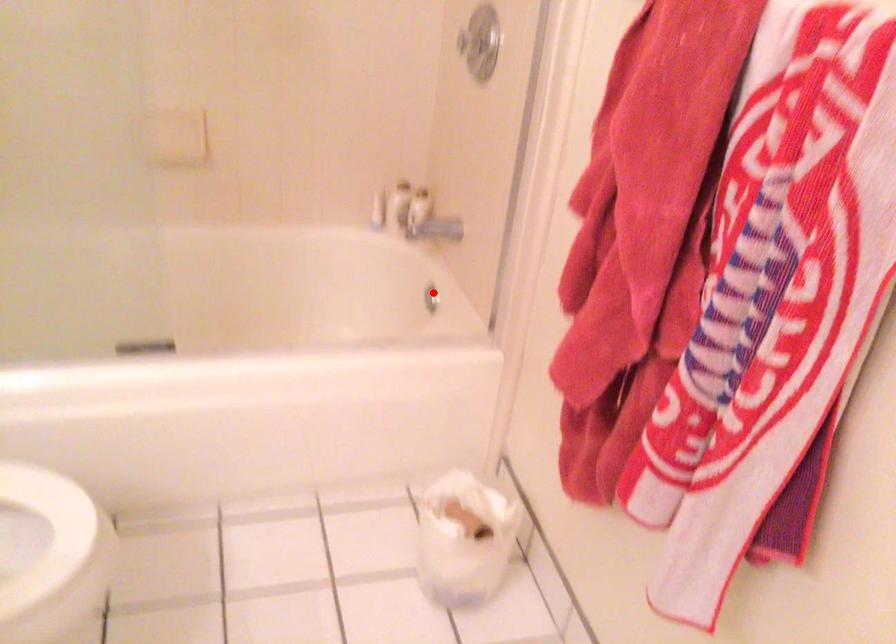
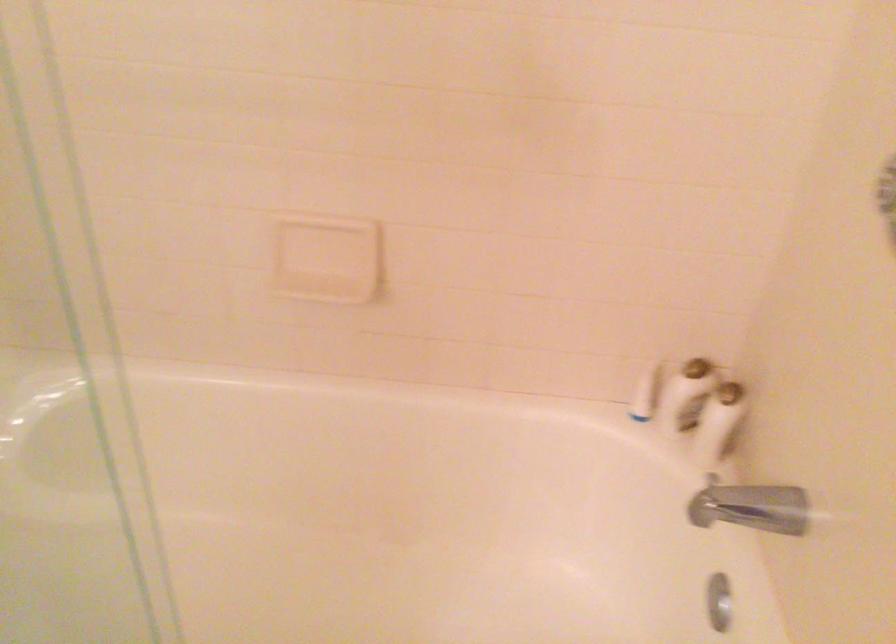
In the second image, find the point that corresponds to the highlighted location in the first image.

(719, 601)